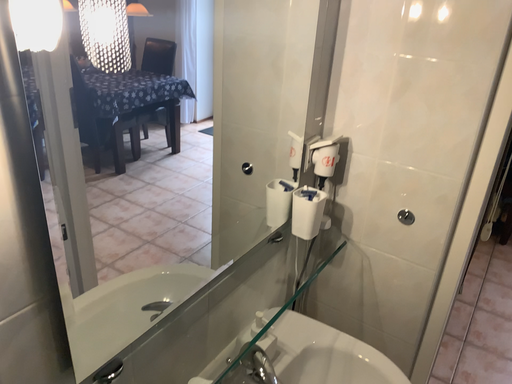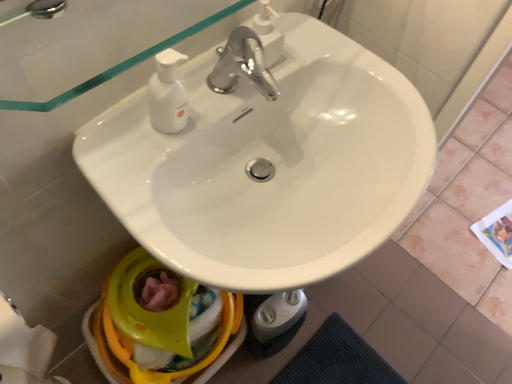
Question: How did the camera likely rotate when shooting the video?

Choices:
 (A) rotated right
 (B) rotated left

Answer: (B)